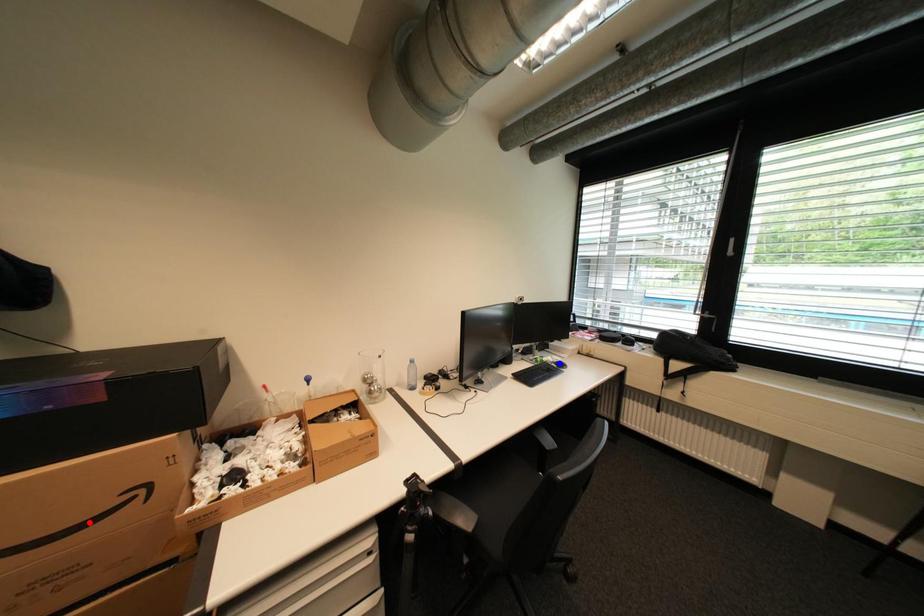
Question: Which of the two points in the image is closer to the camera?

Choices:
 (A) Blue point is closer.
 (B) Red point is closer.

Answer: (B)